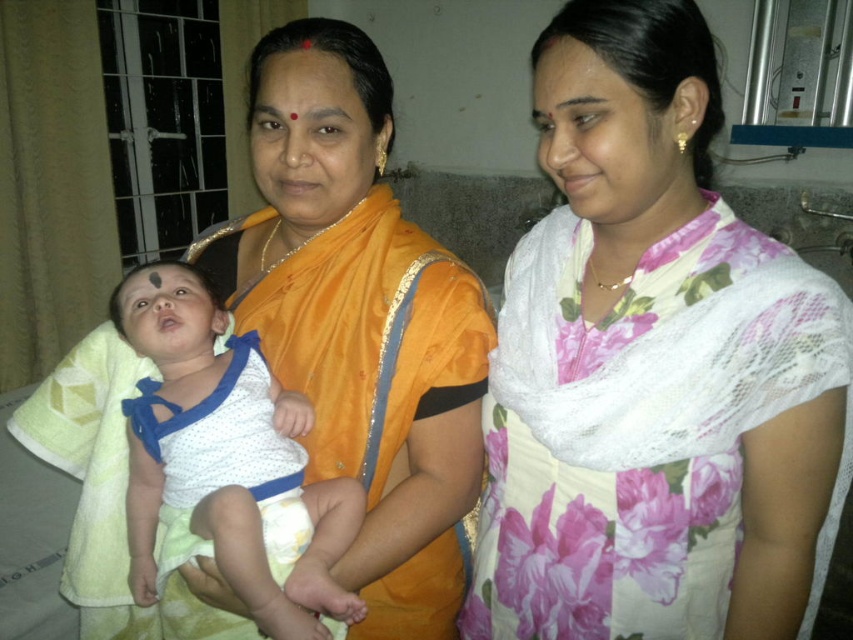
Question: Which of the following is the closest to the observer?

Choices:
 (A) (318, 67)
 (B) (717, 92)
 (C) (286, 477)
 (D) (347, 387)

Answer: (B)

Question: Is the position of white floral saree at center more distant than that of white dotted fabric at center?

Choices:
 (A) yes
 (B) no

Answer: (B)

Question: Is white floral saree at center in front of matte orange forehead at center?

Choices:
 (A) no
 (B) yes

Answer: (B)

Question: Can you confirm if orange silk saree at center is wider than white dotted fabric at center?

Choices:
 (A) no
 (B) yes

Answer: (B)

Question: Which point appears closest to the camera in this image?

Choices:
 (A) (247, 337)
 (B) (251, 58)

Answer: (B)

Question: Estimate the real-world distances between objects in this image. Which object is farther from the white dotted fabric at center?

Choices:
 (A) white floral saree at center
 (B) matte orange forehead at center

Answer: (B)